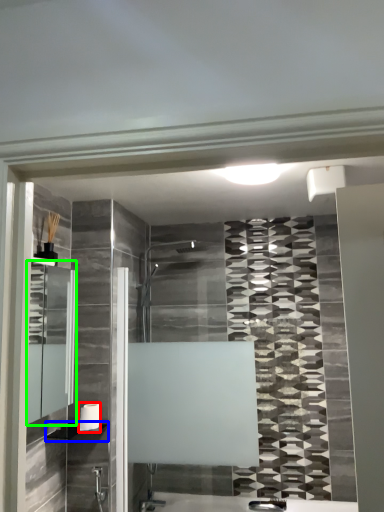
Question: Which object is the farthest from towel bar (highlighted by a red box)? Choose among these: shelf (highlighted by a blue box) or medicine cabinet (highlighted by a green box).

Choices:
 (A) shelf
 (B) medicine cabinet

Answer: (B)